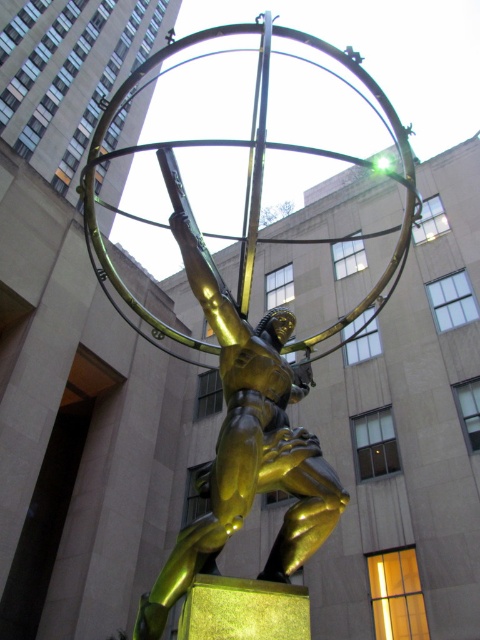
Is shiny gold statue at center shorter than gold polished statue at center?

Incorrect, shiny gold statue at center's height does not fall short of gold polished statue at center's.

Does shiny gold statue at center appear on the right side of gold polished statue at center?

Yes, shiny gold statue at center is to the right of gold polished statue at center.

Is point (140, 333) positioned behind point (309, 371)?

Yes, it is.

This screenshot has height=640, width=480. What are the coordinates of `shiny gold statue at center` in the screenshot? It's located at (248, 340).